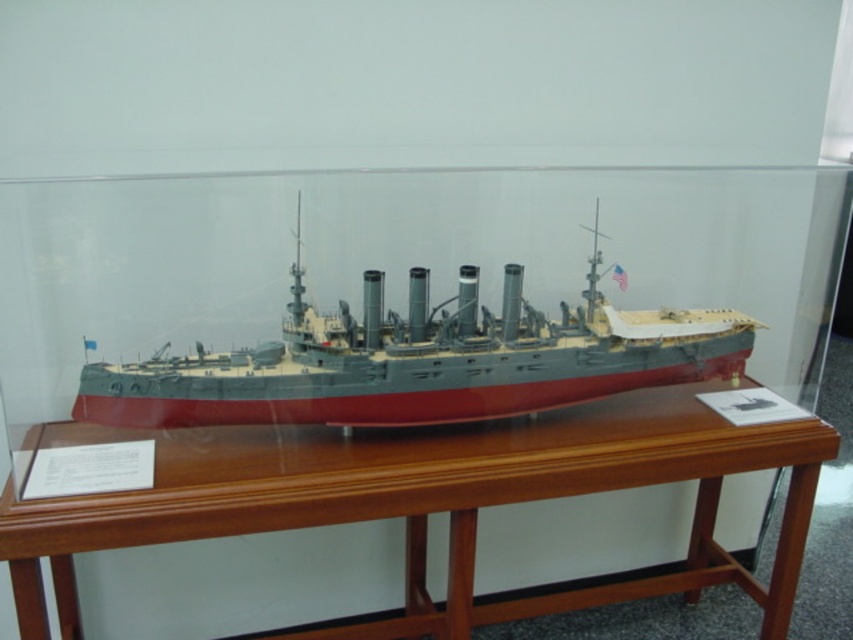
You are a museum curator who needs to ensure the gray metallic ship at center is securely anchored to the brown polished wood table at center. The anchor cable you have can only extend 9 inches. Can the cable reach from the ship to the table?

The brown polished wood table at center is 10.08 inches from the gray metallic ship at center. Since the anchor cable can only extend 9 inches, it is not long enough to reach between them. A longer cable is needed.

You are a curator arranging an exhibition and need to place a new label next to the brown polished wood table at center and the gray metallic ship at center. According to the layout, which object is located to the left of the other?

The brown polished wood table at center is positioned on the left side of gray metallic ship at center, so the table is to the left of the ship.

Consider the image. You are a curator planning to move the naval battleship model from its current position on the brown polished wood table at center to a new location. The new location is at coordinates point (422, 499). Will the battleship fit on the new location without overlapping the edge of the table?

The point (422, 499) corresponds to the brown polished wood table at center, so moving the battleship model there will keep it centered on the table without overlapping the edges.